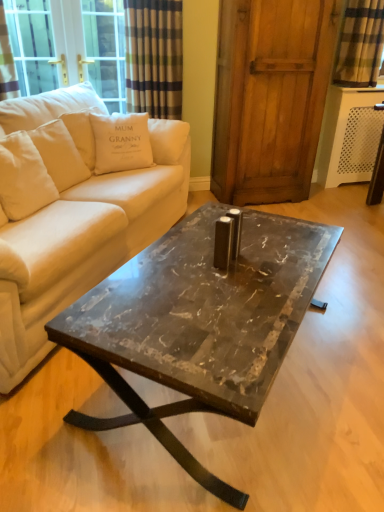
Question: Do you think marble/black at center is within wooden screen door at center, or outside of it?

Choices:
 (A) outside
 (B) inside

Answer: (A)

Question: From the image's perspective, is marble/black at center located above or below wooden screen door at center?

Choices:
 (A) below
 (B) above

Answer: (A)

Question: Which is nearer to the white cotton cushion at upper left, arranged as the second pillow when viewed from the left?

Choices:
 (A) wooden screen door at center
 (B) marble/black at center
 (C) plaid fabric curtain at upper right
 (D) white cotton pillow at upper left, which ranks as the second pillow in right-to-left order
 (E) beige fabric couch at center

Answer: (D)

Question: Which of these objects is positioned closest to the plaid fabric curtain at upper right?

Choices:
 (A) white cotton cushion at upper left, arranged as the second pillow when viewed from the left
 (B) beige fabric couch at center
 (C) wooden screen door at center
 (D) marble/black at center
 (E) white cotton pillow at upper left, which ranks as the second pillow in right-to-left order

Answer: (C)